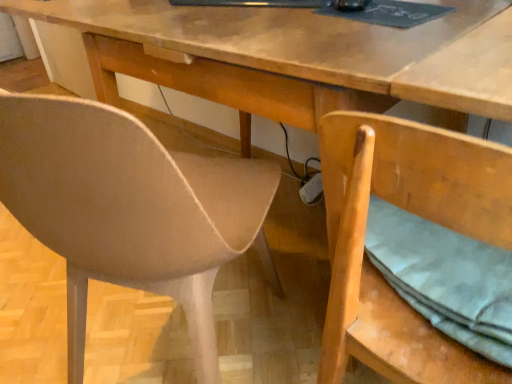
Question: Is wooden chair at lower right, arranged as the second chair when viewed from the left, taller or shorter than matte beige chair at left, arranged as the 1th chair when viewed from the left?

Choices:
 (A) short
 (B) tall

Answer: (A)

Question: Is point (351, 283) closer or farther from the camera than point (198, 236)?

Choices:
 (A) farther
 (B) closer

Answer: (B)

Question: Is wooden chair at lower right, which is counted as the 1th chair, starting from the right, in front of or behind matte beige chair at left, which is counted as the 2th chair, starting from the right, in the image?

Choices:
 (A) behind
 (B) front

Answer: (A)

Question: From their relative heights in the image, would you say matte beige chair at left, which is counted as the 2th chair, starting from the right, is taller or shorter than wooden chair at lower right, arranged as the second chair when viewed from the left?

Choices:
 (A) tall
 (B) short

Answer: (A)

Question: Looking at their shapes, would you say matte beige chair at left, arranged as the 1th chair when viewed from the left, is wider or thinner than wooden chair at lower right, which is counted as the 1th chair, starting from the right?

Choices:
 (A) thin
 (B) wide

Answer: (B)

Question: From a real-world perspective, is matte beige chair at left, which is counted as the 2th chair, starting from the right, above or below wooden chair at lower right, arranged as the second chair when viewed from the left?

Choices:
 (A) below
 (B) above

Answer: (A)

Question: Would you say matte beige chair at left, arranged as the 1th chair when viewed from the left, is to the left or to the right of wooden chair at lower right, which is counted as the 1th chair, starting from the right, in the picture?

Choices:
 (A) right
 (B) left

Answer: (B)